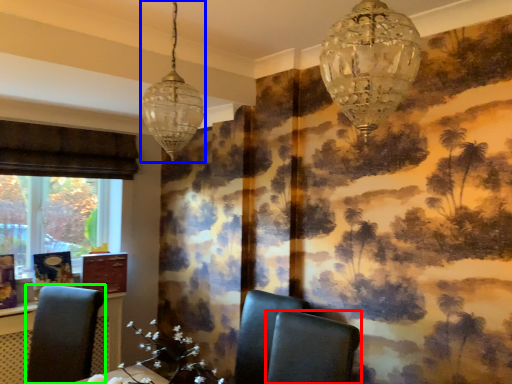
Question: Based on their relative distances, which object is nearer to chair (highlighted by a red box)? Choose from lamp (highlighted by a blue box) and chair (highlighted by a green box).

Choices:
 (A) lamp
 (B) chair

Answer: (A)